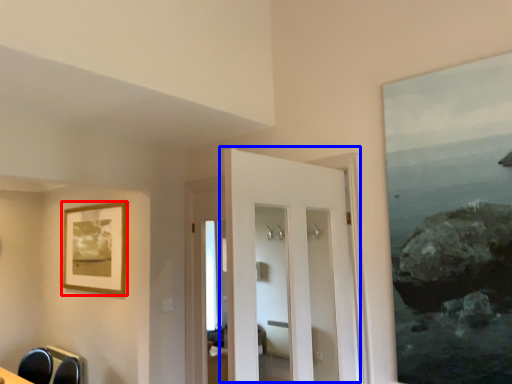
Question: Which object appears farthest to the camera in this image, picture frame (highlighted by a red box) or door (highlighted by a blue box)?

Choices:
 (A) picture frame
 (B) door

Answer: (A)